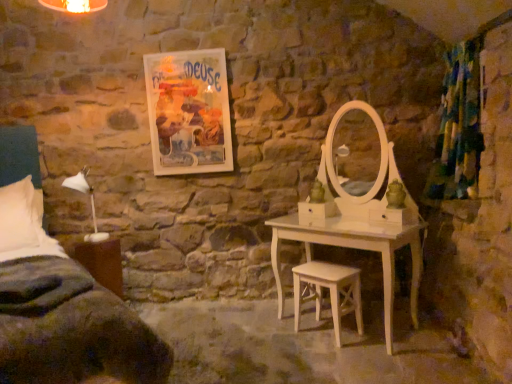
Question: Does textured green curtain at right come in front of dark green fabric bed at left?

Choices:
 (A) yes
 (B) no

Answer: (B)

Question: From the image's perspective, would you say textured green curtain at right is positioned over dark green fabric bed at left?

Choices:
 (A) yes
 (B) no

Answer: (A)

Question: Is textured green curtain at right located outside dark green fabric bed at left?

Choices:
 (A) no
 (B) yes

Answer: (B)

Question: Is textured green curtain at right further to the viewer compared to dark green fabric bed at left?

Choices:
 (A) no
 (B) yes

Answer: (B)

Question: Would you say dark green fabric bed at left is part of textured green curtain at right's contents?

Choices:
 (A) no
 (B) yes

Answer: (A)

Question: Is textured green curtain at right in front of or behind dark green fabric bed at left in the image?

Choices:
 (A) behind
 (B) front

Answer: (A)

Question: From the image's perspective, is textured green curtain at right positioned above or below dark green fabric bed at left?

Choices:
 (A) below
 (B) above

Answer: (B)

Question: From a real-world perspective, is textured green curtain at right positioned above or below dark green fabric bed at left?

Choices:
 (A) above
 (B) below

Answer: (A)

Question: Which is correct: textured green curtain at right is inside dark green fabric bed at left, or outside of it?

Choices:
 (A) outside
 (B) inside

Answer: (A)

Question: Considering the positions of brown wood nightstand at lower left and white wood stool at center in the image, is brown wood nightstand at lower left wider or thinner than white wood stool at center?

Choices:
 (A) thin
 (B) wide

Answer: (B)

Question: From a real-world perspective, relative to white wood stool at center, is brown wood nightstand at lower left vertically above or below?

Choices:
 (A) above
 (B) below

Answer: (A)

Question: In the image, is brown wood nightstand at lower left positioned in front of or behind white wood stool at center?

Choices:
 (A) front
 (B) behind

Answer: (B)

Question: Considering the positions of brown wood nightstand at lower left and white wood stool at center in the image, is brown wood nightstand at lower left bigger or smaller than white wood stool at center?

Choices:
 (A) big
 (B) small

Answer: (A)

Question: Is dark green fabric bed at left inside or outside of matte paper poster at upper center?

Choices:
 (A) outside
 (B) inside

Answer: (A)

Question: In terms of size, does dark green fabric bed at left appear bigger or smaller than matte paper poster at upper center?

Choices:
 (A) big
 (B) small

Answer: (A)